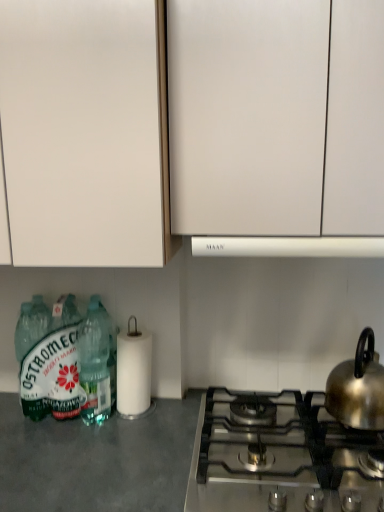
Where is `free space in front of green matte bottle at lower left, the first bottle viewed from the left`? The width and height of the screenshot is (384, 512). free space in front of green matte bottle at lower left, the first bottle viewed from the left is located at coordinates (49, 443).